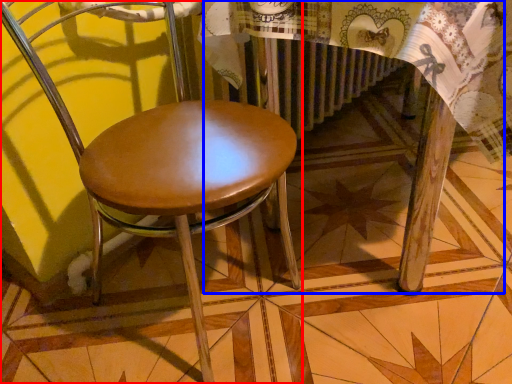
Question: Which object appears farthest to the camera in this image, chair (highlighted by a red box) or round table (highlighted by a blue box)?

Choices:
 (A) chair
 (B) round table

Answer: (B)